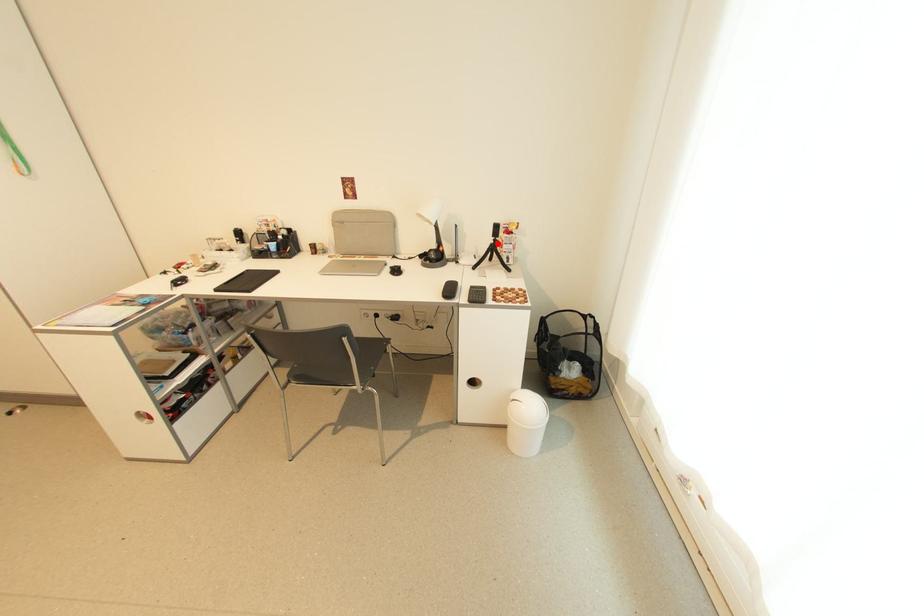
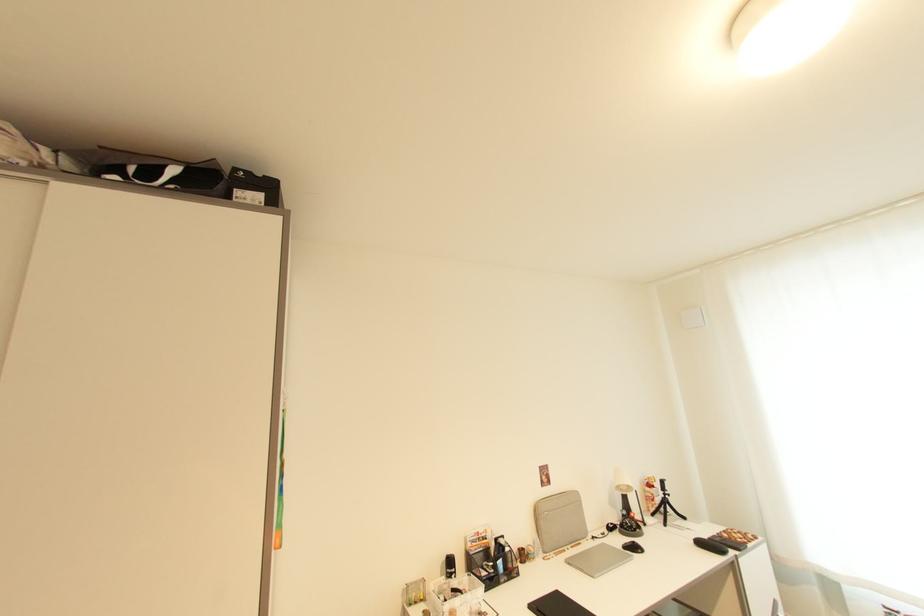
Question: I am providing you with two images of the same scene from different viewpoints. Image1 has a red point marked. In image2, the corresponding 3D location appears at what relative position? Reply with the corresponding letter.

Choices:
 (A) Closer
 (B) Farther

Answer: (B)